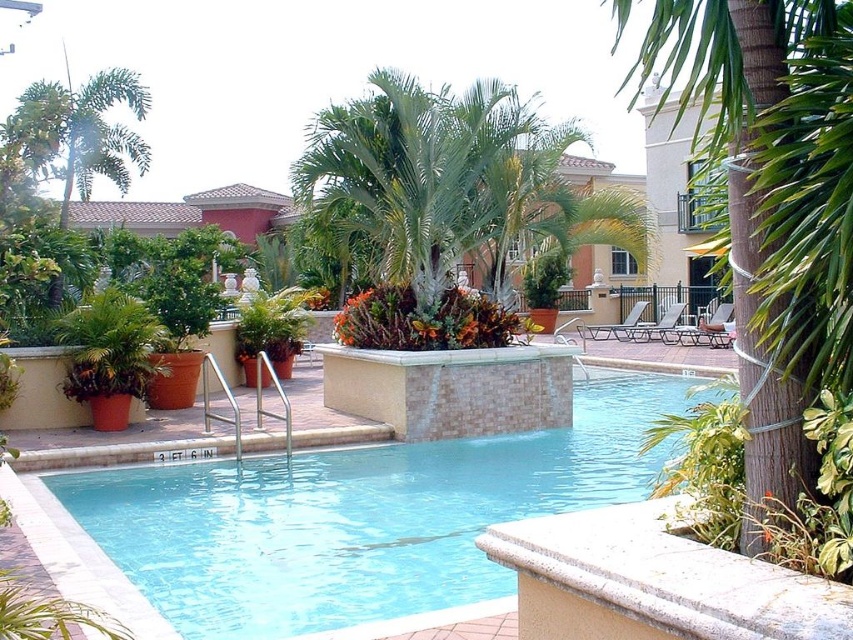
You are a lifeguard standing on the pool deck and notice both the clear blue water at center and the green leafy palm tree at center. Which object is positioned higher from the ground level?

The green leafy palm tree at center is higher than the clear blue water at center because the water is located below the palm tree.